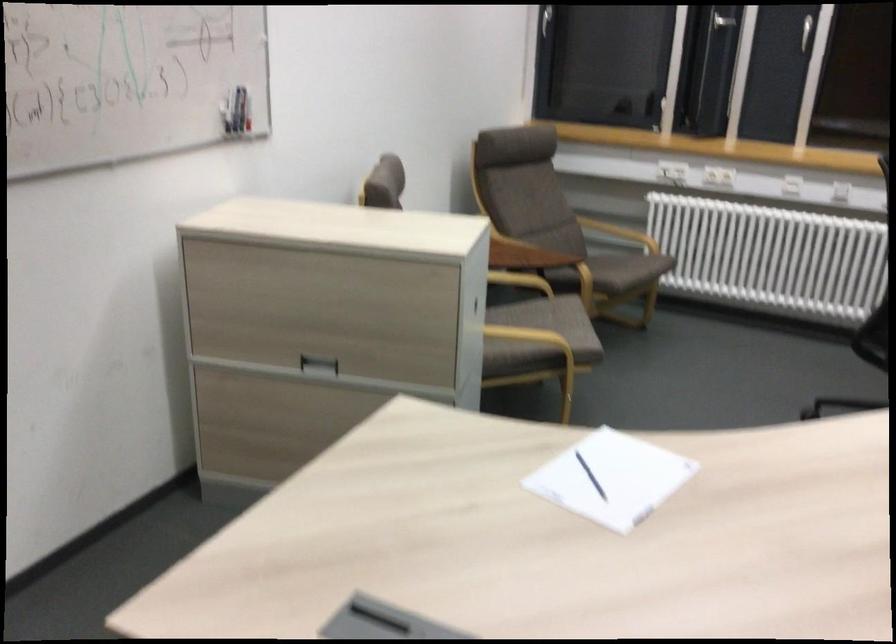
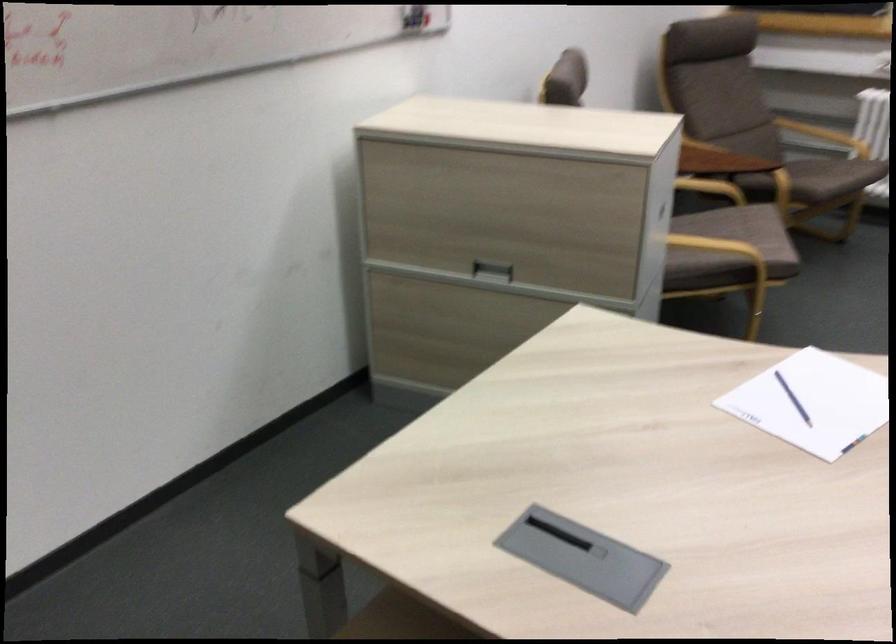
The point at (555, 323) is marked in the first image. Where is the corresponding point in the second image?

(746, 232)